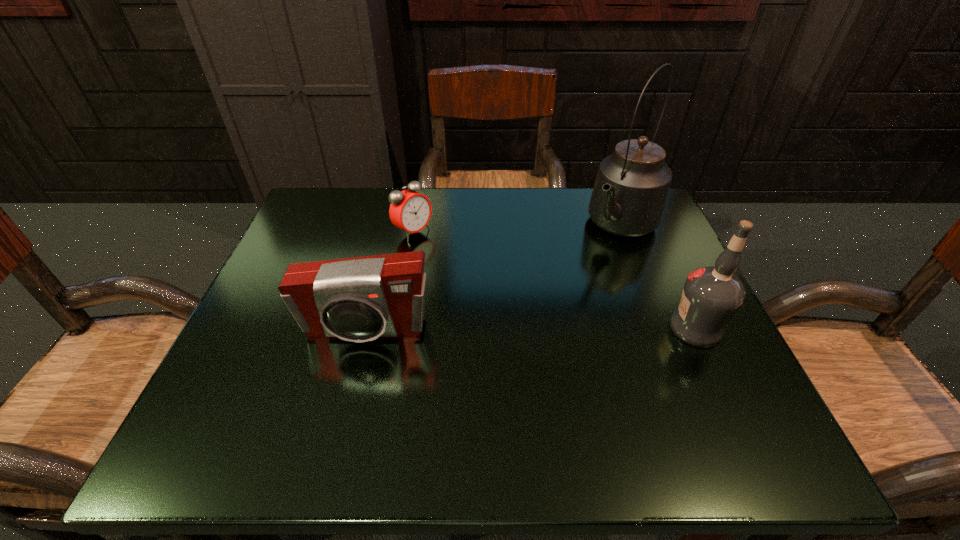
Where is `vacant space on the desktop that is between the third tallest object and the second tallest object and is positioned on the front-facing side of the shortest object`? This screenshot has height=540, width=960. vacant space on the desktop that is between the third tallest object and the second tallest object and is positioned on the front-facing side of the shortest object is located at coordinates (569, 329).

Where is `free space on the desktop that is between the camera and the second tallest object and is positioned spout on the tallest object`? The image size is (960, 540). free space on the desktop that is between the camera and the second tallest object and is positioned spout on the tallest object is located at coordinates (517, 329).